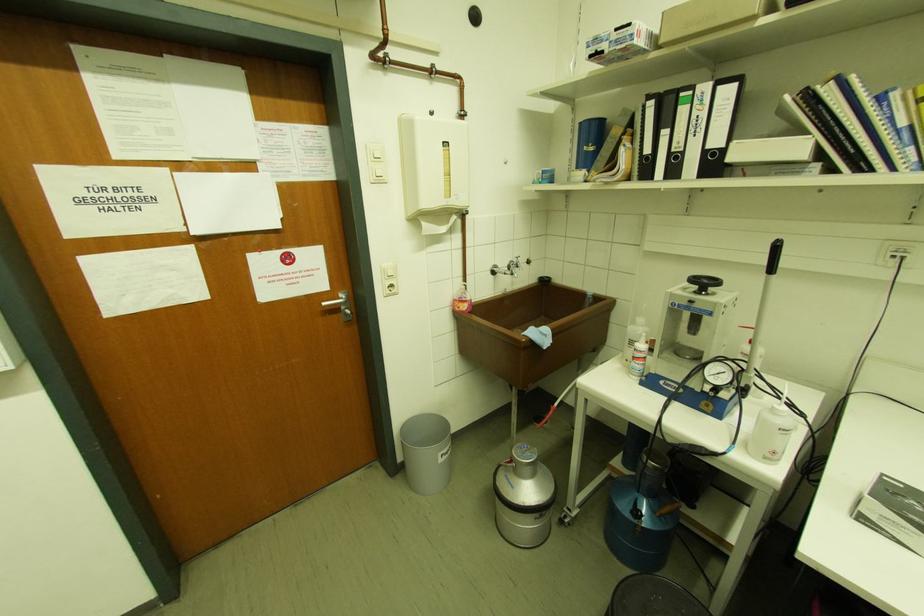
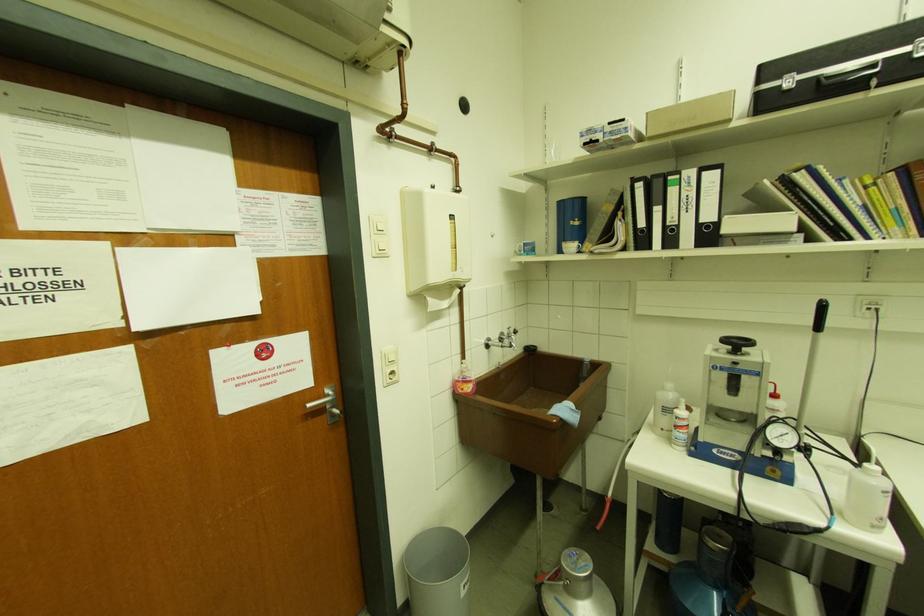
Locate, in the second image, the point that corresponds to [720,284] in the first image.

(752, 344)